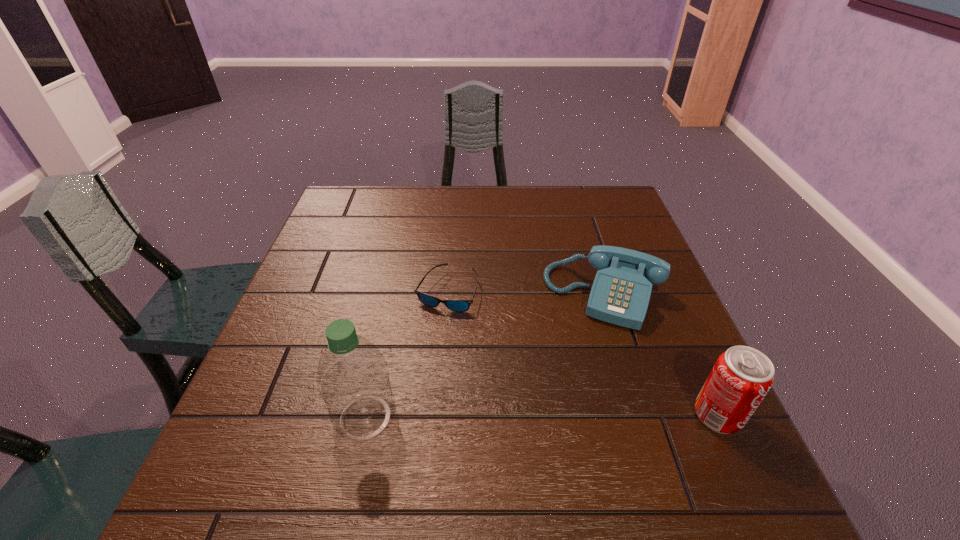
The width and height of the screenshot is (960, 540). Find the location of `the tallest object`. the tallest object is located at coordinates (353, 380).

You are a GUI agent. You are given a task and a screenshot of the screen. Output one action in this format:
    pyautogui.click(x=<x>, y=<y>)
    Task: Click on the leftmost object
    This screenshot has width=960, height=540.
    Given the screenshot: What is the action you would take?
    pyautogui.click(x=353, y=380)

Image resolution: width=960 pixels, height=540 pixels. I want to click on soda can, so click(x=742, y=376).

Find the location of a particular element. The width and height of the screenshot is (960, 540). the third object from right to left is located at coordinates (455, 305).

Locate an element on the screen. sunglasses is located at coordinates (455, 305).

Find the location of a particular element. telephone is located at coordinates (620, 294).

Identify the location of free point located on the left of the leftmost object. (232, 417).

Locate an element on the screen. The width and height of the screenshot is (960, 540). free point located 0.150m on the back of the soda can is located at coordinates (683, 337).

Locate an element on the screen. This screenshot has height=540, width=960. free space located 0.300m at the front of the second object from left to right showing the lenses is located at coordinates (507, 421).

Where is `free spot located at the front of the second object from left to right showing the lenses`? The image size is (960, 540). free spot located at the front of the second object from left to right showing the lenses is located at coordinates (477, 357).